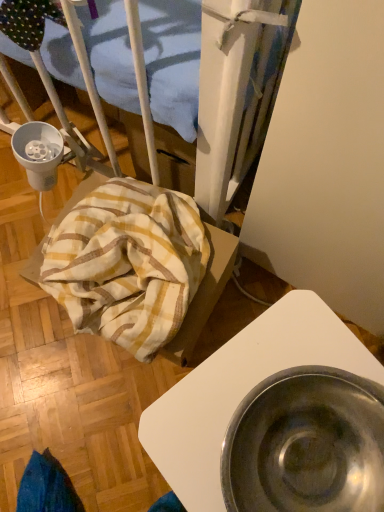
Question: Is metallic silver bowl at lower right inside the boundaries of yellow-white striped fabric at lower left, or outside?

Choices:
 (A) outside
 (B) inside

Answer: (A)

Question: Considering the positions of metallic silver bowl at lower right and yellow-white striped fabric at lower left in the image, is metallic silver bowl at lower right bigger or smaller than yellow-white striped fabric at lower left?

Choices:
 (A) big
 (B) small

Answer: (A)

Question: Considering the positions of metallic silver bowl at lower right and yellow-white striped fabric at lower left in the image, is metallic silver bowl at lower right wider or thinner than yellow-white striped fabric at lower left?

Choices:
 (A) wide
 (B) thin

Answer: (A)

Question: Is yellow-white striped fabric at lower left wider or thinner than metallic silver bowl at lower right?

Choices:
 (A) thin
 (B) wide

Answer: (A)

Question: From their relative heights in the image, would you say yellow-white striped fabric at lower left is taller or shorter than metallic silver bowl at lower right?

Choices:
 (A) tall
 (B) short

Answer: (B)

Question: Based on their sizes in the image, would you say yellow-white striped fabric at lower left is bigger or smaller than metallic silver bowl at lower right?

Choices:
 (A) big
 (B) small

Answer: (B)

Question: From the image's perspective, relative to metallic silver bowl at lower right, is yellow-white striped fabric at lower left above or below?

Choices:
 (A) below
 (B) above

Answer: (B)